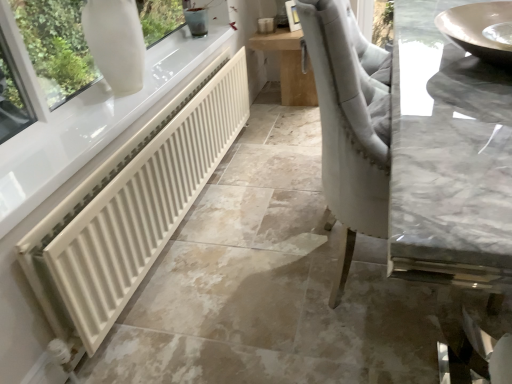
Where is `free spot below white matte radiator at lower left (from a real-world perspective)`? The width and height of the screenshot is (512, 384). free spot below white matte radiator at lower left (from a real-world perspective) is located at coordinates (192, 215).